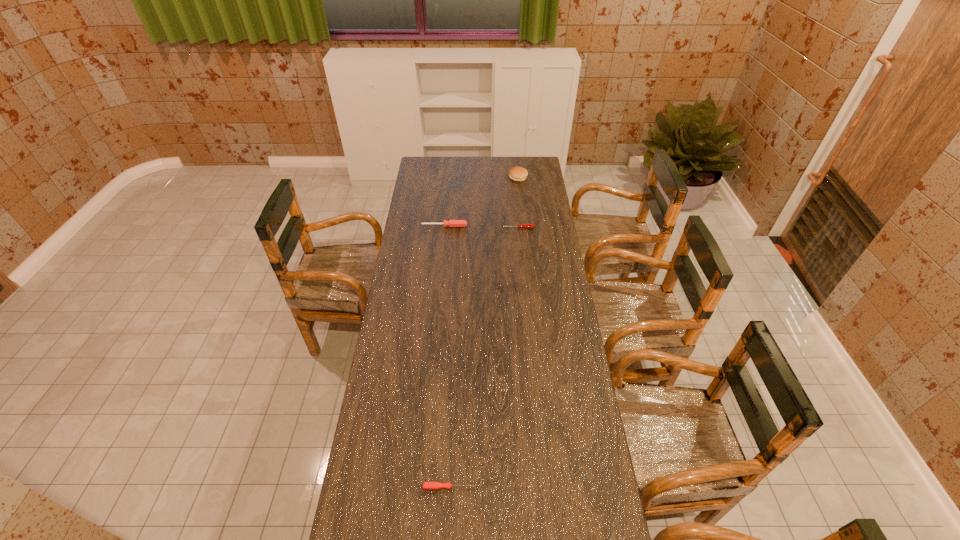
In order to click on free space between the rightmost screwdriver and the nearest screwdriver in this screenshot , I will do `click(484, 357)`.

Find the location of a particular element. free space between the second tallest object and the farthest object is located at coordinates (481, 202).

Where is `free space between the nearest screwdriver and the farthest object`? Image resolution: width=960 pixels, height=540 pixels. free space between the nearest screwdriver and the farthest object is located at coordinates (484, 332).

At what (x,y) coordinates should I click in order to perform the action: click on vacant area that lies between the rightmost screwdriver and the farthest object. Please return your answer as a coordinate pair (x, y). Looking at the image, I should click on (518, 203).

Find the location of a particular element. The image size is (960, 540). blank region between the tallest screwdriver and the farthest object is located at coordinates (481, 202).

Find the location of a particular element. free space between the nearest object and the farthest object is located at coordinates [484, 332].

Where is `free space between the second tallest object and the third tallest object`? This screenshot has width=960, height=540. free space between the second tallest object and the third tallest object is located at coordinates (481, 227).

The image size is (960, 540). I want to click on vacant area that lies between the tallest screwdriver and the tallest object, so click(481, 202).

I want to click on empty space that is in between the shortest screwdriver and the third shortest object, so click(x=447, y=356).

Locate an element on the screen. Image resolution: width=960 pixels, height=540 pixels. vacant space in between the tallest screwdriver and the second shortest object is located at coordinates (481, 227).